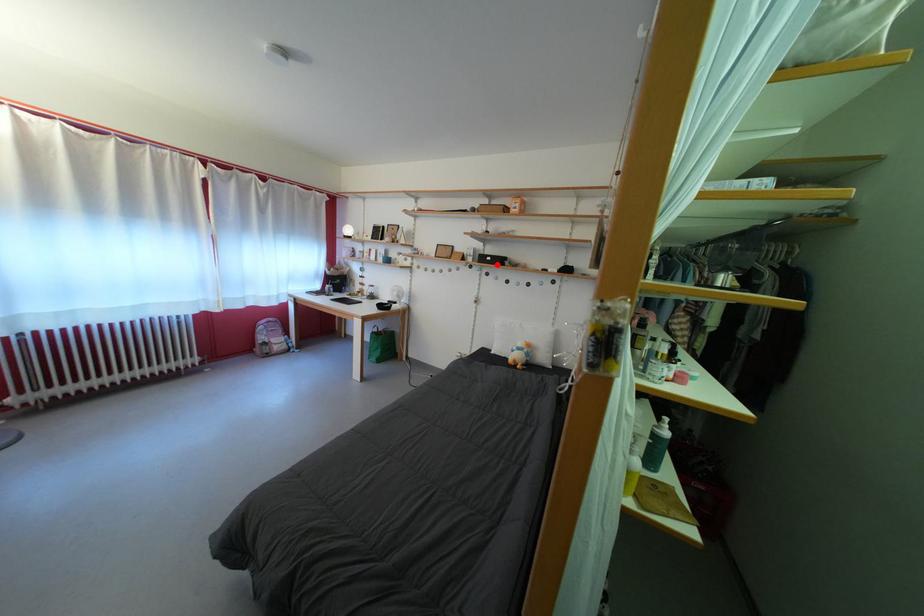
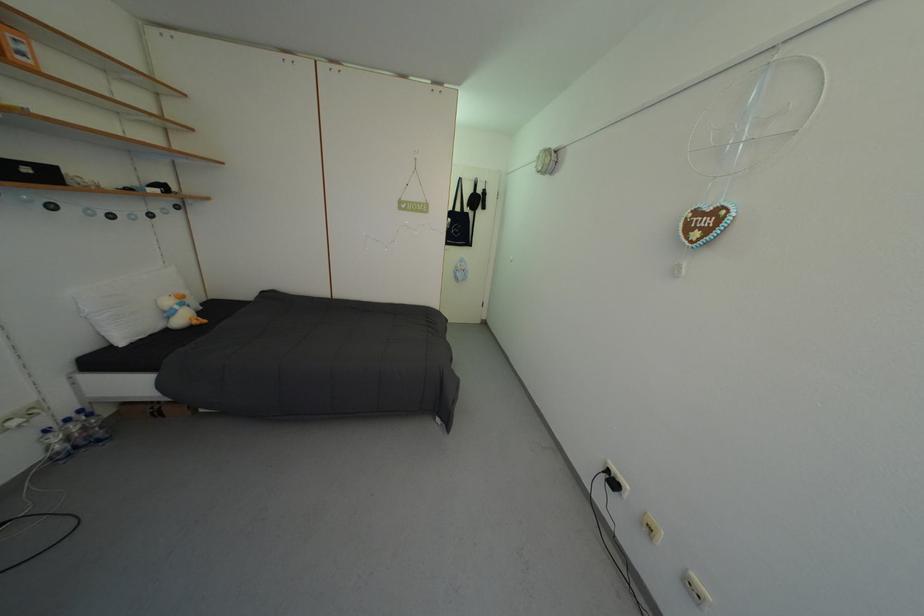
In the second image, find the point that corresponds to the highlighted location in the first image.

(35, 176)